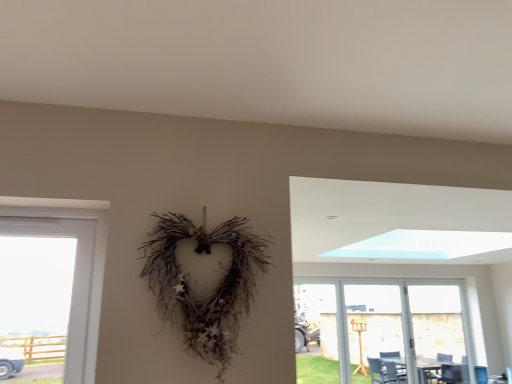
What do you see at coordinates (437, 321) in the screenshot?
I see `transparent glass screen door at right, which is the 1th screen door from right to left` at bounding box center [437, 321].

Where is `transparent plastic screen door at right, the first screen door in the left-to-right sequence`? transparent plastic screen door at right, the first screen door in the left-to-right sequence is located at coordinates (374, 321).

This screenshot has width=512, height=384. What are the coordinates of `transparent glass screen door at right, which is the 1th screen door from right to left` in the screenshot? It's located at (437, 321).

Considering the relative sizes of transparent glass screen door at right, which is the 2th screen door in left-to-right order, and transparent glass door at lower right in the image provided, is transparent glass screen door at right, which is the 2th screen door in left-to-right order, bigger than transparent glass door at lower right?

Actually, transparent glass screen door at right, which is the 2th screen door in left-to-right order, might be smaller than transparent glass door at lower right.

In terms of width, does transparent glass screen door at right, which is the 1th screen door from right to left, look wider or thinner when compared to transparent glass door at lower right?

In the image, transparent glass screen door at right, which is the 1th screen door from right to left, appears to be more narrow than transparent glass door at lower right.

Between transparent glass screen door at right, which is the 1th screen door from right to left, and transparent glass door at lower right, which one is positioned in front?

Positioned in front is transparent glass door at lower right.

How many degrees apart are the facing directions of transparent plastic screen door at right, the first screen door in the left-to-right sequence, and transparent glass screen door at right, which is the 2th screen door in left-to-right order?

There is a 0.000446-degree angle between the facing directions of transparent plastic screen door at right, the first screen door in the left-to-right sequence, and transparent glass screen door at right, which is the 2th screen door in left-to-right order.

Between transparent plastic screen door at right, the first screen door in the left-to-right sequence, and transparent glass screen door at right, which is the 1th screen door from right to left, which one has less height?

Standing shorter between the two is transparent plastic screen door at right, the first screen door in the left-to-right sequence.

Does transparent plastic screen door at right, marked as the second screen door in a right-to-left arrangement, have a smaller size compared to transparent glass screen door at right, which is the 1th screen door from right to left?

Indeed, transparent plastic screen door at right, marked as the second screen door in a right-to-left arrangement, has a smaller size compared to transparent glass screen door at right, which is the 1th screen door from right to left.

Which is less distant, (366, 293) or (461, 332)?

The point (461, 332) is closer to the camera.

Considering the relative positions of transparent glass door at lower right and transparent plastic screen door at right, the first screen door in the left-to-right sequence, in the image provided, is transparent glass door at lower right behind transparent plastic screen door at right, the first screen door in the left-to-right sequence,?

No, transparent glass door at lower right is in front of transparent plastic screen door at right, the first screen door in the left-to-right sequence.

Are transparent glass door at lower right and transparent plastic screen door at right, the first screen door in the left-to-right sequence, beside each other?

No, transparent glass door at lower right is not touching transparent plastic screen door at right, the first screen door in the left-to-right sequence.

From the image's perspective, which is above, transparent glass door at lower right or transparent plastic screen door at right, the first screen door in the left-to-right sequence?

transparent plastic screen door at right, the first screen door in the left-to-right sequence, from the image's perspective.

Can you confirm if transparent glass door at lower right is taller than transparent plastic screen door at right, marked as the second screen door in a right-to-left arrangement?

No, transparent glass door at lower right is not taller than transparent plastic screen door at right, marked as the second screen door in a right-to-left arrangement.

Considering the relative positions of transparent glass door at lower right and transparent glass screen door at right, which is the 2th screen door in left-to-right order, in the image provided, is transparent glass door at lower right to the right of transparent glass screen door at right, which is the 2th screen door in left-to-right order, from the viewer's perspective?

Incorrect, transparent glass door at lower right is not on the right side of transparent glass screen door at right, which is the 2th screen door in left-to-right order.

Is transparent glass door at lower right aimed at transparent glass screen door at right, which is the 1th screen door from right to left?

Yes, transparent glass door at lower right is facing transparent glass screen door at right, which is the 1th screen door from right to left.

Which is behind, transparent glass door at lower right or transparent glass screen door at right, which is the 1th screen door from right to left?

transparent glass screen door at right, which is the 1th screen door from right to left, is further away from the camera.

In terms of width, does transparent glass screen door at right, which is the 2th screen door in left-to-right order, look wider or thinner when compared to transparent plastic screen door at right, the first screen door in the left-to-right sequence?

In the image, transparent glass screen door at right, which is the 2th screen door in left-to-right order, appears to be wider than transparent plastic screen door at right, the first screen door in the left-to-right sequence.

Considering the relative positions of transparent glass screen door at right, which is the 1th screen door from right to left, and transparent plastic screen door at right, the first screen door in the left-to-right sequence, in the image provided, is transparent glass screen door at right, which is the 1th screen door from right to left, in front of transparent plastic screen door at right, the first screen door in the left-to-right sequence,?

No, it is behind transparent plastic screen door at right, the first screen door in the left-to-right sequence.

What are the coordinates of `screen door in front of the transparent glass screen door at right, which is the 1th screen door from right to left` in the screenshot? It's located at (374, 321).

Consider the image. From the image's perspective, between transparent glass screen door at right, which is the 2th screen door in left-to-right order, and transparent plastic screen door at right, marked as the second screen door in a right-to-left arrangement, which one is located above?

transparent plastic screen door at right, marked as the second screen door in a right-to-left arrangement, appears higher in the image.

What's the angular difference between transparent plastic screen door at right, the first screen door in the left-to-right sequence, and transparent glass door at lower right's facing directions?

transparent plastic screen door at right, the first screen door in the left-to-right sequence, and transparent glass door at lower right are facing 0.000357 degrees away from each other.

From the image's perspective, is transparent plastic screen door at right, marked as the second screen door in a right-to-left arrangement, located above or below transparent glass door at lower right?

transparent plastic screen door at right, marked as the second screen door in a right-to-left arrangement, is above transparent glass door at lower right.

From a real-world perspective, is transparent plastic screen door at right, marked as the second screen door in a right-to-left arrangement, physically below transparent glass door at lower right?

No, from a real-world perspective, transparent plastic screen door at right, marked as the second screen door in a right-to-left arrangement, is not below transparent glass door at lower right.

Is transparent plastic screen door at right, the first screen door in the left-to-right sequence, situated inside transparent glass door at lower right or outside?

transparent plastic screen door at right, the first screen door in the left-to-right sequence, is spatially positioned inside transparent glass door at lower right.

The image size is (512, 384). In order to click on window below the transparent glass screen door at right, which is the 2th screen door in left-to-right order (from a real-world perspective) in this screenshot , I will do 387,326.

You are a GUI agent. You are given a task and a screenshot of the screen. Output one action in this format:
    pyautogui.click(x=<x>, y=<y>)
    Task: Click on the screen door on the right side of transparent plastic screen door at right, marked as the second screen door in a right-to-left arrangement
    This screenshot has width=512, height=384.
    Given the screenshot: What is the action you would take?
    pyautogui.click(x=437, y=321)

Looking at the image, which one is located further to transparent glass screen door at right, which is the 1th screen door from right to left, transparent glass door at lower right or transparent plastic screen door at right, the first screen door in the left-to-right sequence?

transparent plastic screen door at right, the first screen door in the left-to-right sequence, lies further to transparent glass screen door at right, which is the 1th screen door from right to left, than the other object.

Looking at the image, which one is located closer to transparent glass screen door at right, which is the 2th screen door in left-to-right order, transparent plastic screen door at right, marked as the second screen door in a right-to-left arrangement, or transparent glass door at lower right?

transparent glass door at lower right is positioned closer to the anchor transparent glass screen door at right, which is the 2th screen door in left-to-right order.

Estimate the real-world distances between objects in this image. Which object is further from transparent glass door at lower right, transparent glass screen door at right, which is the 2th screen door in left-to-right order, or transparent plastic screen door at right, the first screen door in the left-to-right sequence?

Based on the image, transparent glass screen door at right, which is the 2th screen door in left-to-right order, appears to be further to transparent glass door at lower right.

Considering their positions, is transparent glass screen door at right, which is the 1th screen door from right to left, positioned closer to transparent plastic screen door at right, marked as the second screen door in a right-to-left arrangement, than transparent glass door at lower right?

transparent glass door at lower right is closer to transparent plastic screen door at right, marked as the second screen door in a right-to-left arrangement.

Estimate the real-world distances between objects in this image. Which object is further from transparent glass door at lower right, transparent plastic screen door at right, the first screen door in the left-to-right sequence, or transparent glass screen door at right, which is the 1th screen door from right to left?

transparent glass screen door at right, which is the 1th screen door from right to left.

Based on their spatial positions, is transparent glass door at lower right or transparent glass screen door at right, which is the 2th screen door in left-to-right order, closer to transparent plastic screen door at right, marked as the second screen door in a right-to-left arrangement?

Based on the image, transparent glass door at lower right appears to be nearer to transparent plastic screen door at right, marked as the second screen door in a right-to-left arrangement.

You are a GUI agent. You are given a task and a screenshot of the screen. Output one action in this format:
    pyautogui.click(x=<x>, y=<y>)
    Task: Click on the window situated between transparent plastic screen door at right, marked as the second screen door in a right-to-left arrangement, and transparent glass screen door at right, which is the 2th screen door in left-to-right order, from left to right
    This screenshot has width=512, height=384.
    Given the screenshot: What is the action you would take?
    pyautogui.click(x=387, y=326)